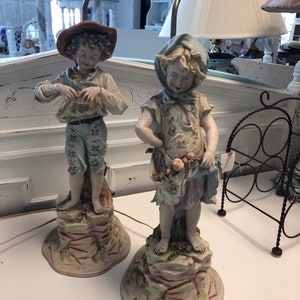
Find the location of `white table`. white table is located at coordinates (108, 290).